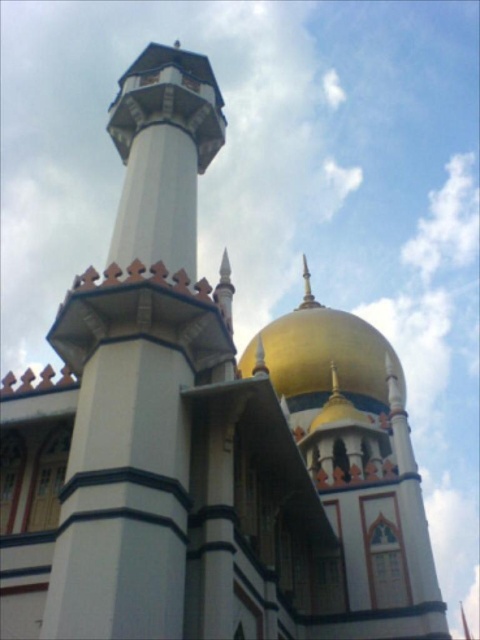
Question: Is gold shiny dome at upper center positioned before white stone minaret at upper left?

Choices:
 (A) no
 (B) yes

Answer: (B)

Question: Which point is closer to the camera taking this photo?

Choices:
 (A) (x=308, y=307)
 (B) (x=192, y=129)

Answer: (B)

Question: Can you confirm if gold shiny dome at upper center is thinner than white stone minaret at upper left?

Choices:
 (A) no
 (B) yes

Answer: (A)

Question: Which point is farther to the camera?

Choices:
 (A) white stone minaret at upper left
 (B) gold shiny dome at upper center

Answer: (A)

Question: Which point is closer to the camera?

Choices:
 (A) gold shiny dome at upper center
 (B) white stone minaret at upper left

Answer: (A)

Question: Can you confirm if gold shiny dome at upper center is positioned to the left of white stone minaret at upper left?

Choices:
 (A) yes
 (B) no

Answer: (B)